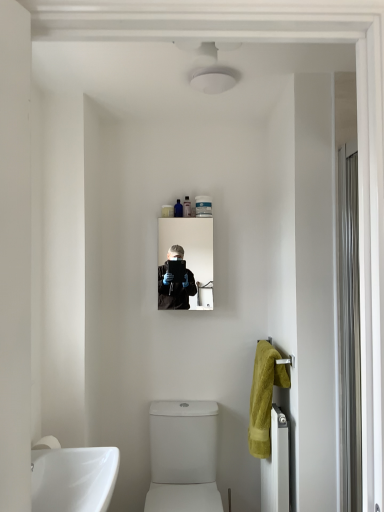
Identify the location of free space above soft yellow towel at right (from a real-world perspective). (270, 346).